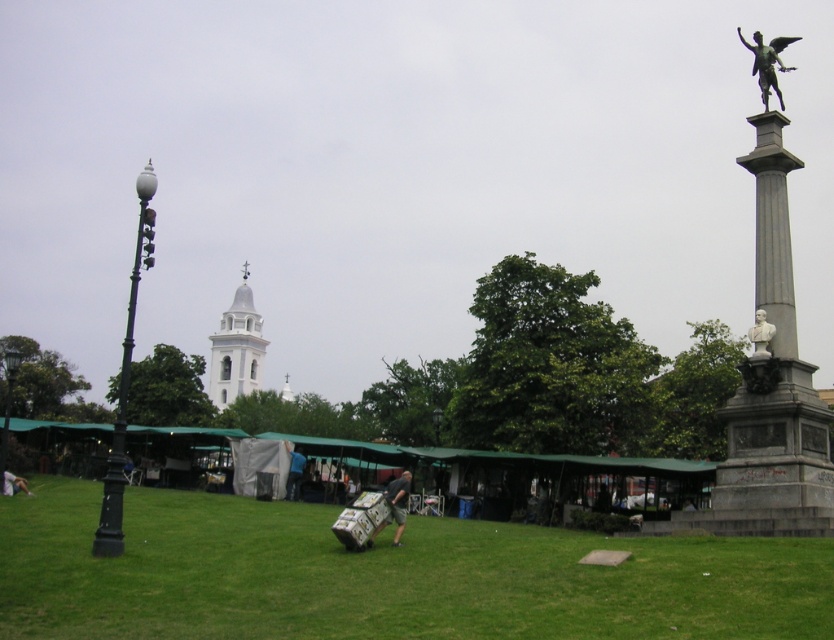
You are a photographer positioned in the public square. You want to capture a photo that includes both the bronze statue at upper right and the white marble bust at right. Based on their positions, which object should appear on the left side of the photo?

The white marble bust at right should appear on the left side of the photo because the bronze statue at upper right is positioned to the right of it.

You are a tourist in the park and want to take a photo of the white marble bust at right. The park has a rule that you cannot stand closer than 1 meter to any monument. Given that you are standing at the point with coordinates point (760,333), which is the location of the white marble bust at right, can you legally take the photo from there?

The point (760,333) indicates the white marble bust at right, so standing at that point would mean you are directly at the monument location. Therefore, you cannot legally take the photo from there as it violates the park rule of staying at least 1 meter away.

You are standing in the public square and want to determine the relative positions of two points marked in the image. Which point is closer to you, point [752,330] or point [299,477]?

Point [752,330] is closer to the viewer than point [299,477].